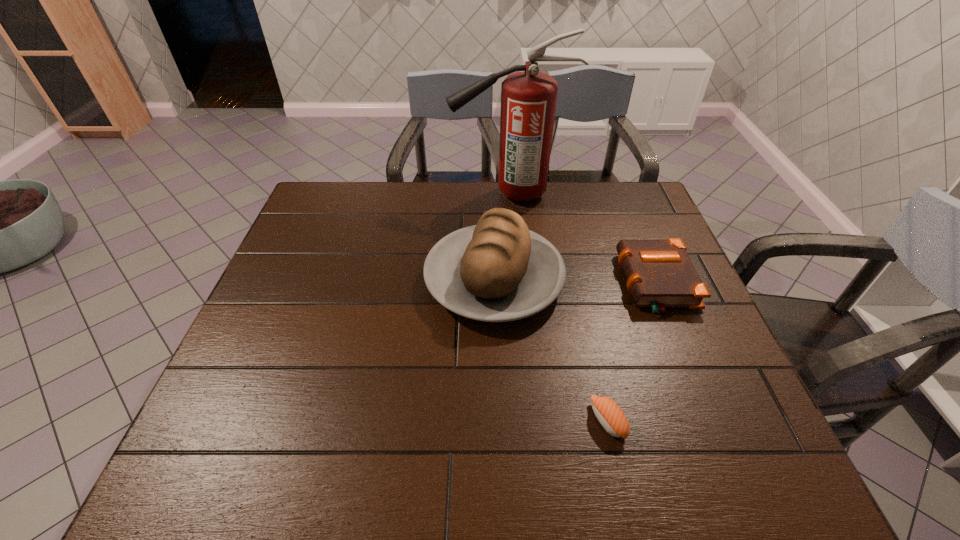
Where is `the tallest object`? the tallest object is located at coordinates (528, 99).

Locate an element on the screen. This screenshot has width=960, height=540. the farthest object is located at coordinates (528, 99).

Where is `the third shortest object`? the third shortest object is located at coordinates (498, 270).

Find the location of a particular element. The height and width of the screenshot is (540, 960). the second shortest object is located at coordinates (659, 273).

Find the location of `Bible`. Bible is located at coordinates (659, 273).

Where is `the nearest object`? the nearest object is located at coordinates (611, 417).

What are the coordinates of `sushi` in the screenshot? It's located at (611, 417).

Find the location of `vacant space located 0.400m at the nozzle of the tallest object`. vacant space located 0.400m at the nozzle of the tallest object is located at coordinates (333, 193).

The width and height of the screenshot is (960, 540). Find the location of `free space located at the nozzle of the tallest object`. free space located at the nozzle of the tallest object is located at coordinates click(x=369, y=193).

Locate an element on the screen. The width and height of the screenshot is (960, 540). free space located 0.130m at the nozzle of the tallest object is located at coordinates (413, 193).